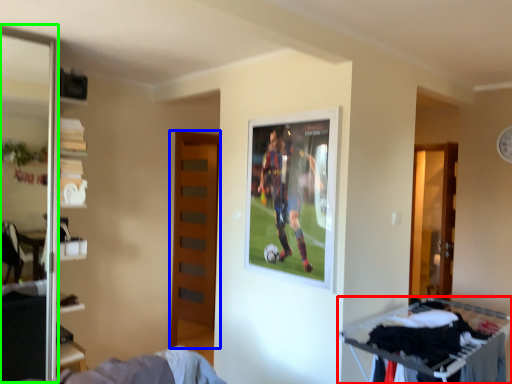
Question: Which is nearer to the furniture (highlighted by a red box)? door (highlighted by a blue box) or screen door (highlighted by a green box).

Choices:
 (A) door
 (B) screen door

Answer: (A)